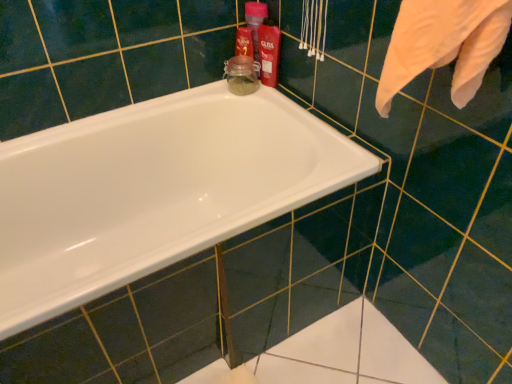
You are a GUI agent. You are given a task and a screenshot of the screen. Output one action in this format:
    pyautogui.click(x=<x>, y=<y>)
    Task: Click on the vacant area that is in front of shiny red plastic bottle at upper right, which ranks as the first cleaning product in front-to-back order
    
    Given the screenshot: What is the action you would take?
    pyautogui.click(x=281, y=98)